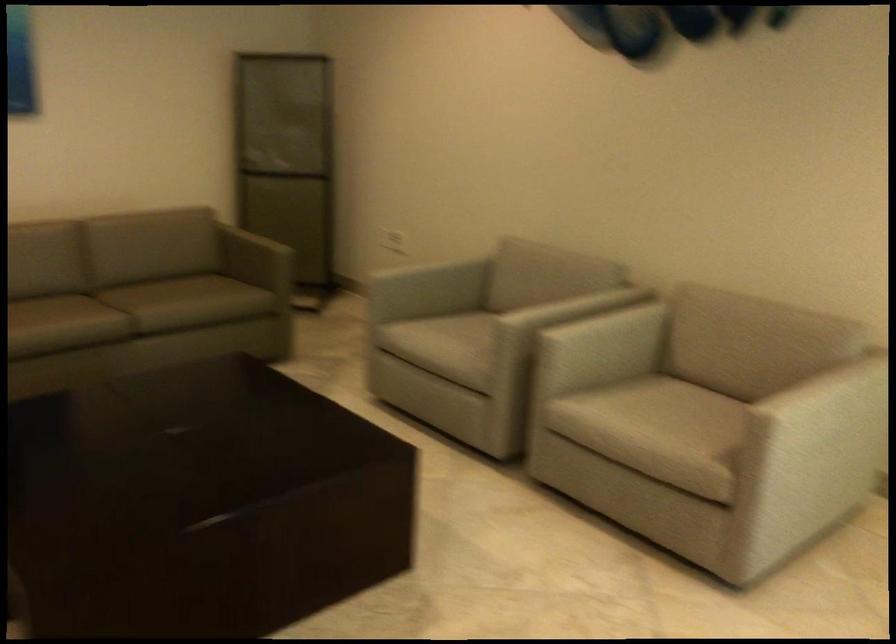
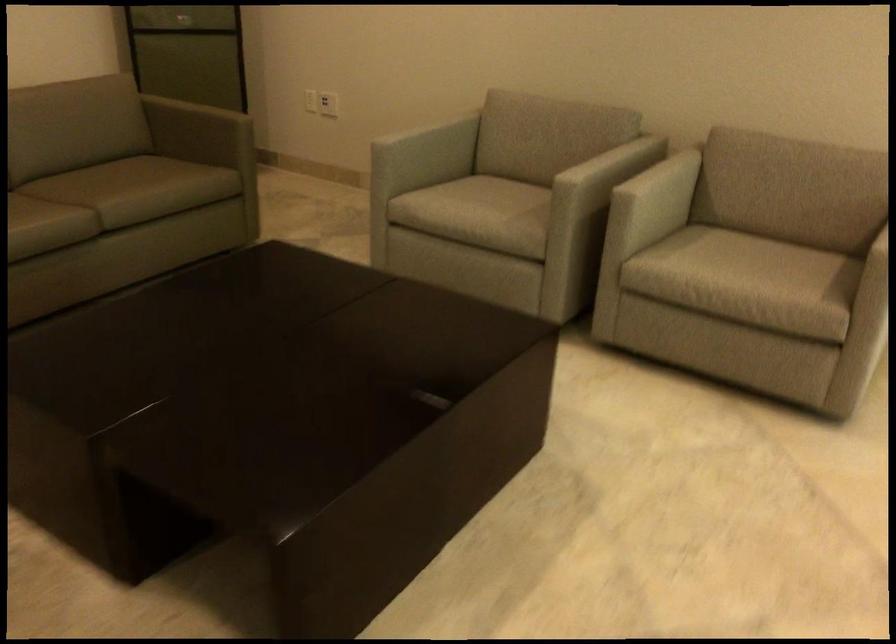
Find the pixel in the second image that matches (613,335) in the first image.

(661, 187)